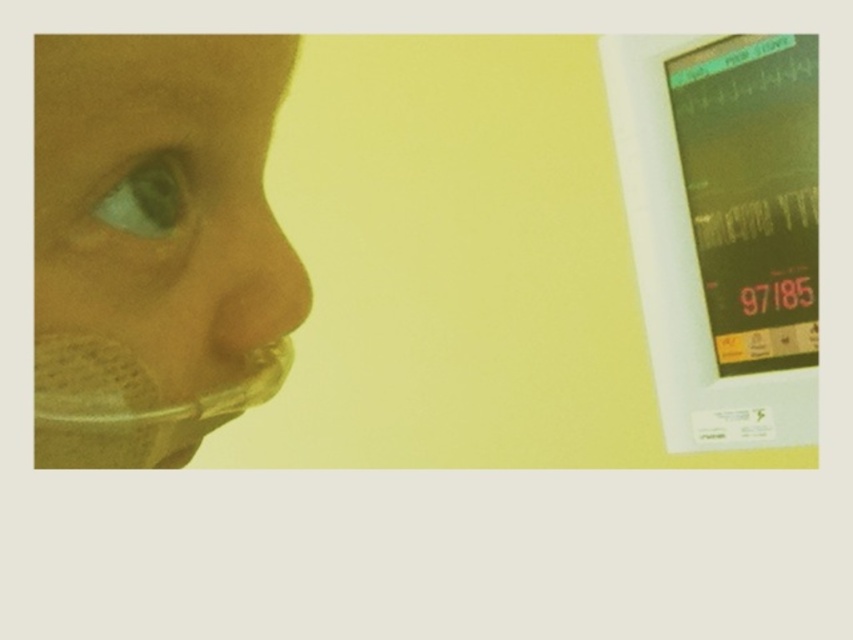
You are a nurse in a hospital room. You need to locate the matte green monitor at right quickly. Where would you look in the room?

The matte green monitor at right is located at point (752, 193) in the room.

Looking at this image, you are a medical technician examining the monitor in the scene. You notice two points on the monitor screen at coordinates point (51, 211) and point (712, 285). Which point is nearer to your eyes?

Point (51, 211) is closer to the viewer than point (712, 285).